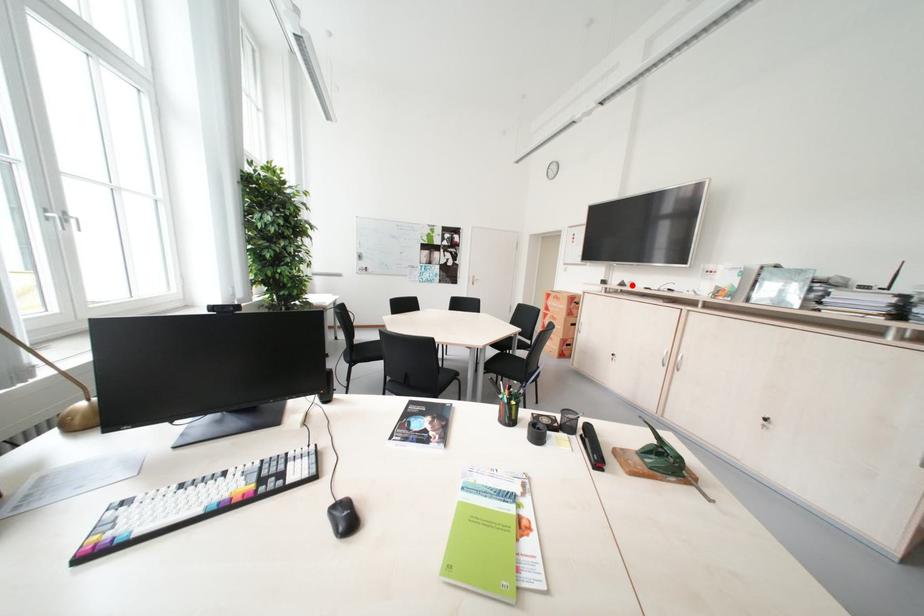
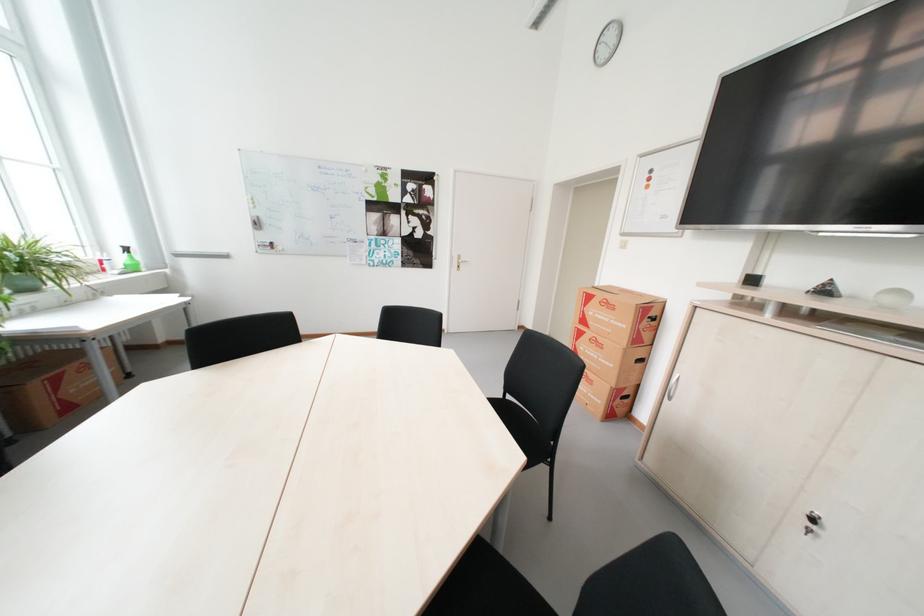
Question: I am providing you with two images of the same scene from different viewpoints. A red point is marked on the first image. At the location where the point appears in image 1, is it still visible in image 2?

Choices:
 (A) Yes
 (B) No

Answer: (A)